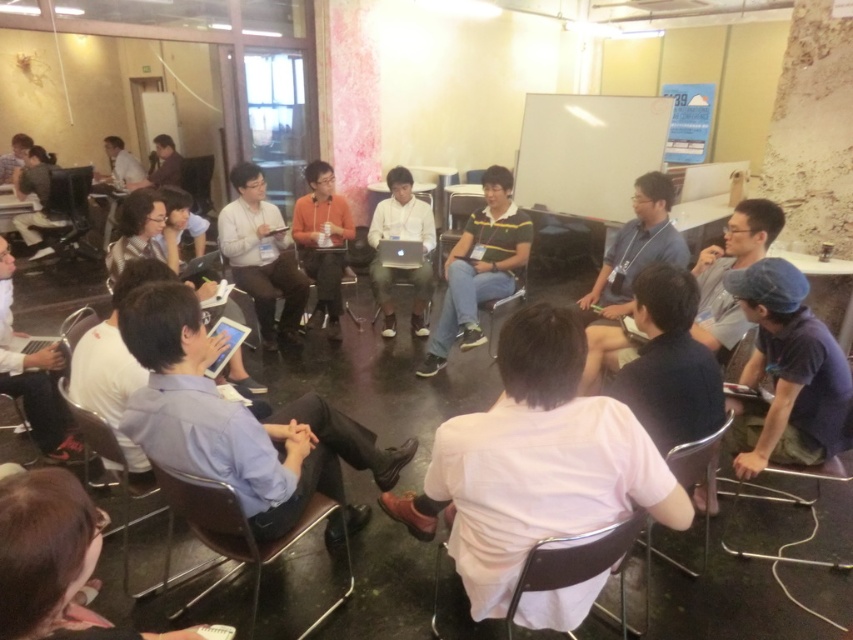
You are standing at the entrance of the room and want to locate the light blue fabric shirt at center. According to the coordinates provided, in which direction should you look relative to your position?

The light blue fabric shirt at center is located at coordinates point (235,420), which means you should look towards the center of the room slightly to your right since the x coordinate is 0.658 indicating right side and y coordinate 0.277 indicating middle height.